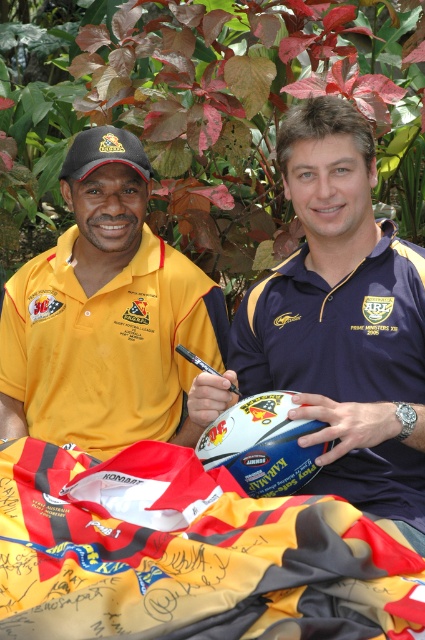
Question: Is yellow and red jersey at lower center further to the viewer compared to yellow matte polo shirt at left?

Choices:
 (A) yes
 (B) no

Answer: (B)

Question: Considering the real-world distances, which object is farthest from the yellow matte polo shirt at left?

Choices:
 (A) blue fabric polo shirt at center
 (B) yellow and red jersey at lower center

Answer: (B)

Question: Which object is closer to the camera taking this photo?

Choices:
 (A) yellow and red jersey at lower center
 (B) yellow matte polo shirt at left
 (C) blue fabric polo shirt at center

Answer: (A)

Question: Which object is the closest to the yellow and red jersey at lower center?

Choices:
 (A) blue fabric polo shirt at center
 (B) yellow matte polo shirt at left

Answer: (A)

Question: Can you confirm if blue fabric polo shirt at center is positioned below yellow matte polo shirt at left?

Choices:
 (A) no
 (B) yes

Answer: (B)

Question: Does yellow and red jersey at lower center have a greater width compared to yellow matte polo shirt at left?

Choices:
 (A) no
 (B) yes

Answer: (B)